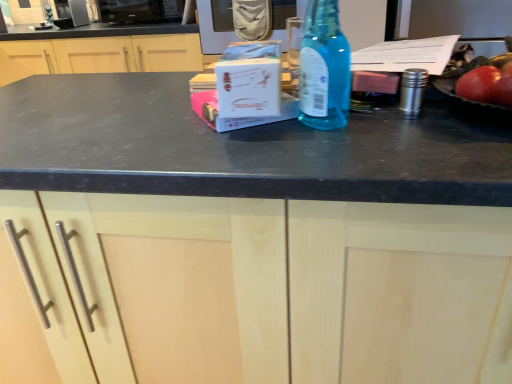
Question: Can you confirm if matte wood cabinet at center, the second cabinetry viewed from the top, is smaller than matte wood cabinet at center, which appears as the second cabinetry when ordered from the bottom?

Choices:
 (A) no
 (B) yes

Answer: (A)

Question: Is matte wood cabinet at center, the first cabinetry from the bottom, outside of matte wood cabinet at center, which appears as the second cabinetry when ordered from the bottom?

Choices:
 (A) no
 (B) yes

Answer: (B)

Question: From the image's perspective, is matte wood cabinet at center, which is the second cabinetry in back-to-front order, over matte wood cabinet at center, acting as the second cabinetry starting from the front?

Choices:
 (A) no
 (B) yes

Answer: (A)

Question: From a real-world perspective, is matte wood cabinet at center, which is the 1th cabinetry in front-to-back order, located higher than matte wood cabinet at center, acting as the first cabinetry starting from the back?

Choices:
 (A) no
 (B) yes

Answer: (A)

Question: Considering the relative sizes of matte wood cabinet at center, the second cabinetry viewed from the top, and matte wood cabinet at center, acting as the second cabinetry starting from the front, in the image provided, is matte wood cabinet at center, the second cabinetry viewed from the top, shorter than matte wood cabinet at center, acting as the second cabinetry starting from the front,?

Choices:
 (A) no
 (B) yes

Answer: (A)

Question: From the image's perspective, is matte wood cabinet at center, which appears as the second cabinetry when ordered from the bottom, positioned above or below matte wood cabinet at center, the first cabinetry from the bottom?

Choices:
 (A) below
 (B) above

Answer: (B)

Question: Would you say matte wood cabinet at center, which appears as the second cabinetry when ordered from the bottom, is to the left or to the right of matte wood cabinet at center, which is the second cabinetry in back-to-front order, in the picture?

Choices:
 (A) left
 (B) right

Answer: (A)

Question: Is matte wood cabinet at center, which appears as the second cabinetry when ordered from the bottom, in front of or behind matte wood cabinet at center, which is the second cabinetry in back-to-front order, in the image?

Choices:
 (A) behind
 (B) front

Answer: (A)

Question: Is point (137, 59) closer or farther from the camera than point (238, 367)?

Choices:
 (A) farther
 (B) closer

Answer: (A)

Question: From their relative heights in the image, would you say blue glass bottle at center is taller or shorter than satin silver microwave at upper left, the 2th appliance when ordered from right to left?

Choices:
 (A) tall
 (B) short

Answer: (A)

Question: From the image's perspective, is blue glass bottle at center positioned above or below satin silver microwave at upper left, the 2th appliance when ordered from right to left?

Choices:
 (A) below
 (B) above

Answer: (A)

Question: In the image, is blue glass bottle at center positioned in front of or behind satin silver microwave at upper left, the 2th appliance when ordered from right to left?

Choices:
 (A) front
 (B) behind

Answer: (A)

Question: Which is correct: blue glass bottle at center is inside satin silver microwave at upper left, the 2th appliance when ordered from right to left, or outside of it?

Choices:
 (A) inside
 (B) outside

Answer: (B)

Question: In terms of size, does satin silver microwave at upper left, the 2th appliance when ordered from right to left, appear bigger or smaller than matte wood cabinet at center, acting as the first cabinetry starting from the back?

Choices:
 (A) big
 (B) small

Answer: (B)

Question: In the image, is satin silver microwave at upper left, the 1th appliance viewed from the left, on the left side or the right side of matte wood cabinet at center, acting as the 1th cabinetry starting from the top?

Choices:
 (A) right
 (B) left

Answer: (B)